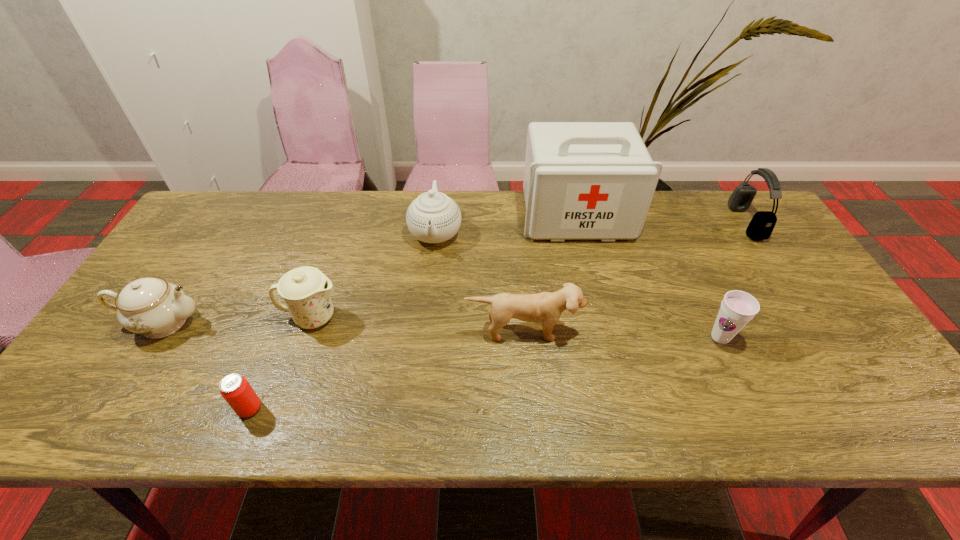
The width and height of the screenshot is (960, 540). I want to click on free region at the near left corner of the desktop, so click(x=84, y=422).

The image size is (960, 540). I want to click on empty space between the puppy and the seventh object from left to right, so click(x=622, y=334).

Find the location of a particular element. Image resolution: width=960 pixels, height=540 pixels. blank region between the second chinaware from left to right and the headset is located at coordinates (529, 269).

Where is `free space between the leftmost chinaware and the puppy`? This screenshot has width=960, height=540. free space between the leftmost chinaware and the puppy is located at coordinates (343, 327).

This screenshot has width=960, height=540. I want to click on free spot between the leftmost chinaware and the puppy, so click(343, 327).

The width and height of the screenshot is (960, 540). In order to click on free spot between the puppy and the leftmost object in this screenshot , I will do `click(343, 327)`.

At what (x,y) coordinates should I click in order to perform the action: click on empty space that is in between the seventh object from left to right and the second chinaware from right to left. Please return your answer as a coordinate pair (x, y). Looking at the image, I should click on (516, 327).

This screenshot has height=540, width=960. In order to click on free space that is in between the leftmost chinaware and the tallest object in this screenshot , I will do `click(370, 269)`.

Locate an element on the screen. The height and width of the screenshot is (540, 960). free space between the puppy and the nearest object is located at coordinates (387, 369).

The height and width of the screenshot is (540, 960). Identify the location of empty space that is in between the second chinaware from right to left and the leftmost chinaware. (237, 320).